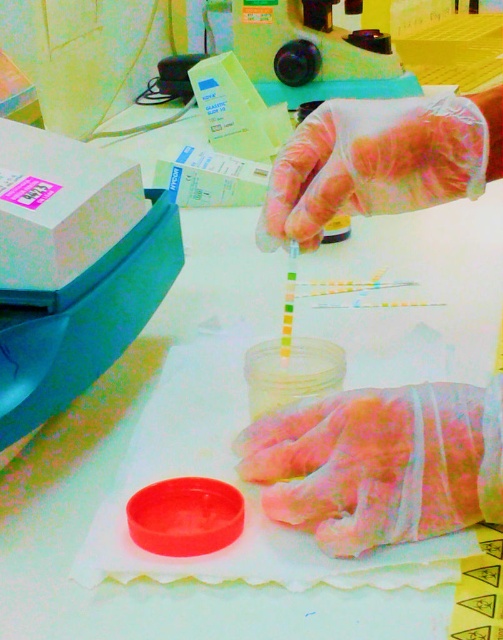
You are organizing lab equipment and need to place the matte plastic box at left and the pink latex glove at center into a drawer. The drawer has a height limit of 10 cm. Can both items fit vertically without bending or folding?

The matte plastic box at left is larger in size than the pink latex glove at center, but without specific height measurements for each item, it is impossible to determine if they can fit vertically in the drawer with the 10 cm height limit.

Consider the image. You are a lab technician who needs to store both the matte plastic box at left and the clear plastic glove at upper center in a vertical storage cabinet. The cabinet has shelves that are spaced 10 cm apart. Can you fit both items on the same shelf without stacking them?

The matte plastic box at left is taller than the clear plastic glove at upper center. Since the shelf spacing is 10 cm, and the height of the box is greater than the glove, but the exact height isn